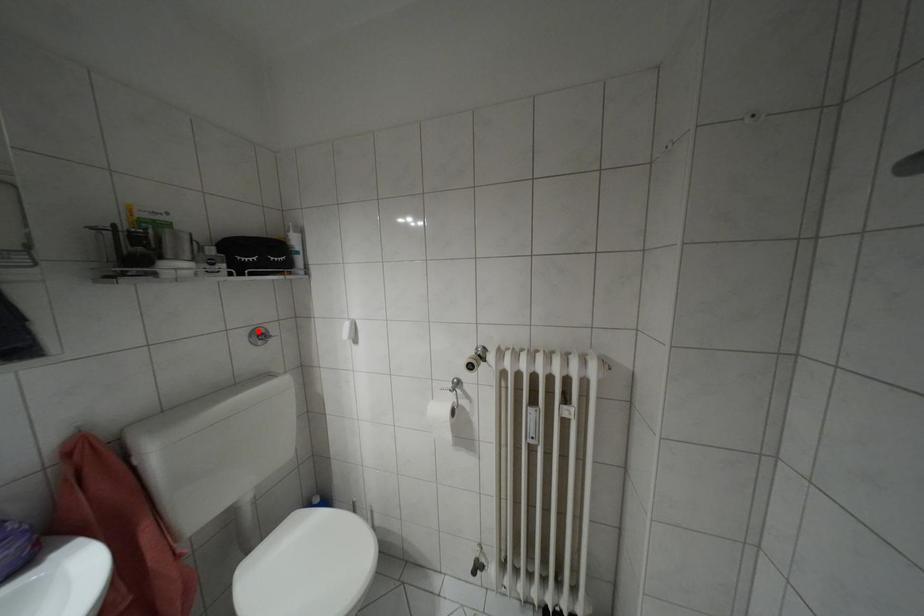
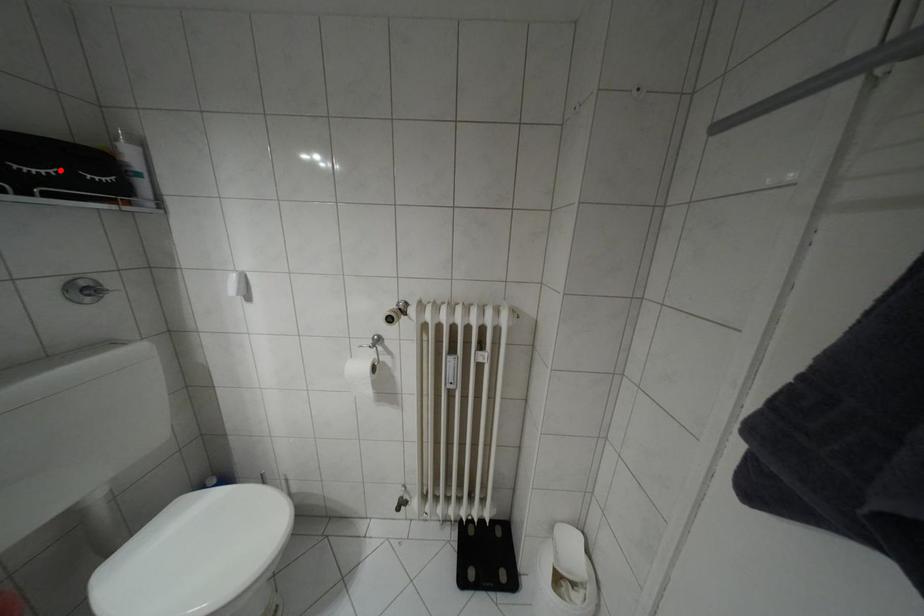
I am providing you with two images of the same scene from different viewpoints. A red point is marked on the first image and another point is marked on the second image. Do the highlighted points in image1 and image2 indicate the same real-world spot?

No